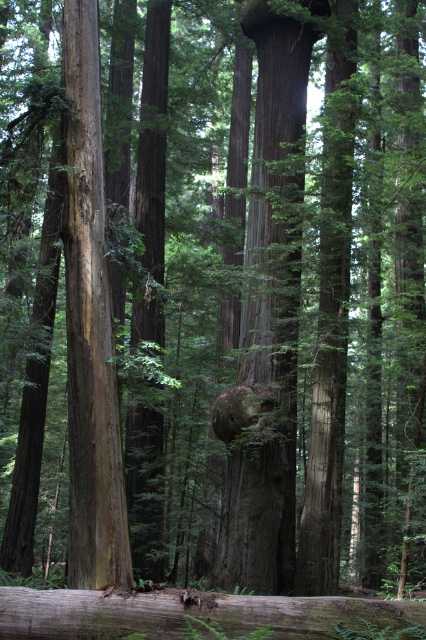
Question: Which point appears closest to the camera in this image?

Choices:
 (A) (144, 595)
 (B) (74, 147)
 (C) (293, 74)

Answer: (A)

Question: Is smooth brown tree trunk at center below grayish-brown wood log at lower center?

Choices:
 (A) no
 (B) yes

Answer: (A)

Question: Estimate the real-world distances between objects in this image. Which object is farther from the grayish-brown wood log at lower center?

Choices:
 (A) smooth brown tree trunk at center
 (B) smooth brown tree trunk at left

Answer: (A)

Question: Is smooth brown tree trunk at center above grayish-brown wood log at lower center?

Choices:
 (A) yes
 (B) no

Answer: (A)

Question: Is smooth brown tree trunk at center smaller than smooth brown tree trunk at left?

Choices:
 (A) yes
 (B) no

Answer: (A)

Question: Among these objects, which one is farthest from the camera?

Choices:
 (A) smooth brown tree trunk at center
 (B) smooth brown tree trunk at left
 (C) grayish-brown wood log at lower center

Answer: (A)